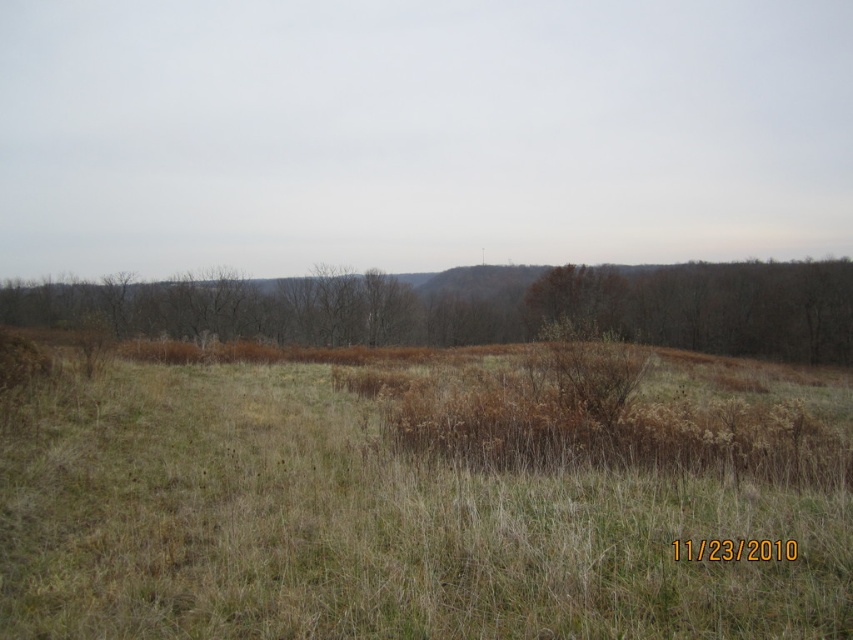
Question: Which of the following is the closest to the observer?

Choices:
 (A) dry grass at center
 (B) brown textured shrub at center

Answer: (A)

Question: Considering the relative positions of dry grass at center and brown textured shrub at center in the image provided, where is dry grass at center located with respect to brown textured shrub at center?

Choices:
 (A) left
 (B) right

Answer: (B)

Question: Among these objects, which one is nearest to the camera?

Choices:
 (A) dry grass at center
 (B) brown textured shrub at center

Answer: (A)

Question: Which point is closer to the camera?

Choices:
 (A) brown textured shrub at center
 (B) dry grass at center

Answer: (B)

Question: Does dry grass at center appear on the right side of brown textured shrub at center?

Choices:
 (A) yes
 (B) no

Answer: (A)

Question: Does dry grass at center have a greater width compared to brown textured shrub at center?

Choices:
 (A) yes
 (B) no

Answer: (B)